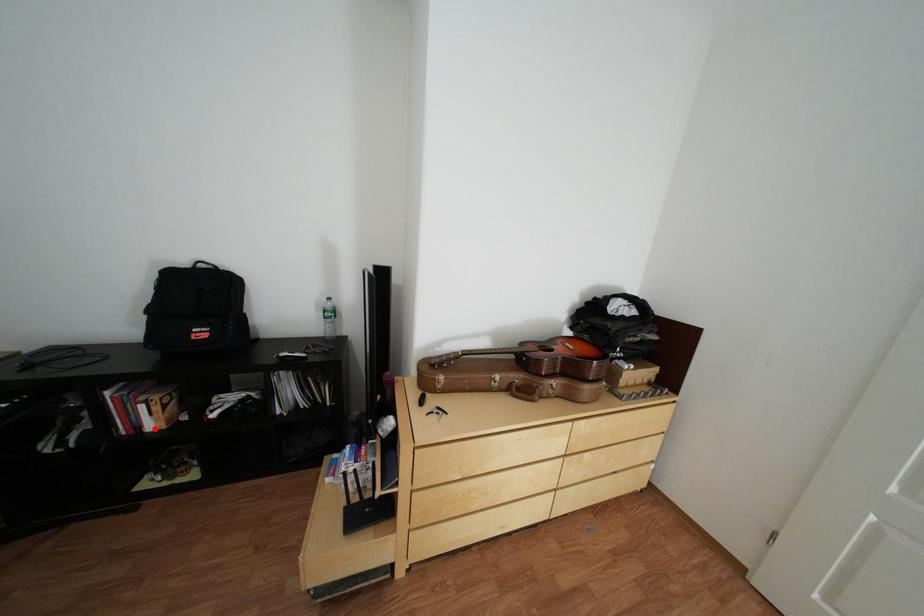
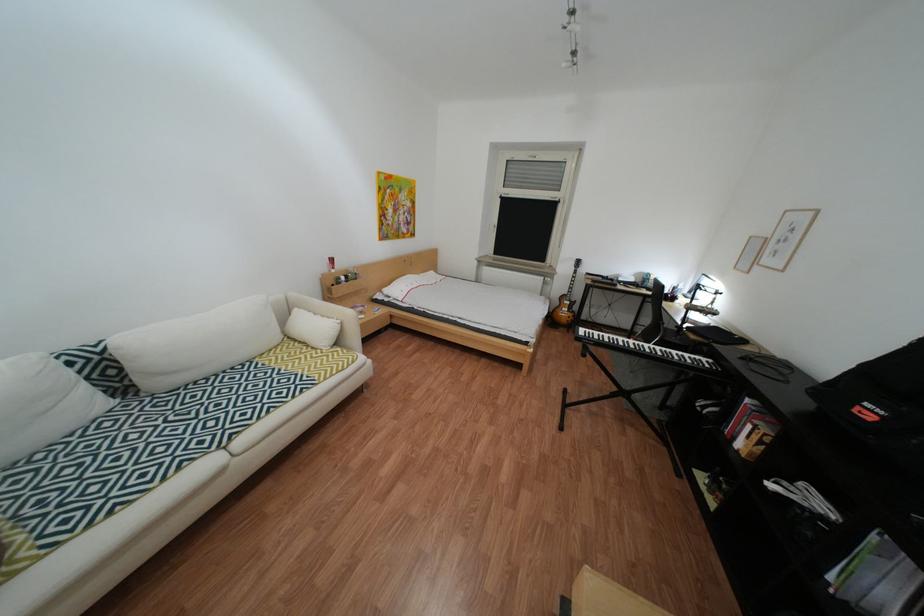
Question: I am providing you with two images of the same scene from different viewpoints. Image1 has a red point marked. In image2, the corresponding 3D location appears at what relative position? Reply with the corresponding letter.

Choices:
 (A) Closer
 (B) Farther

Answer: (B)